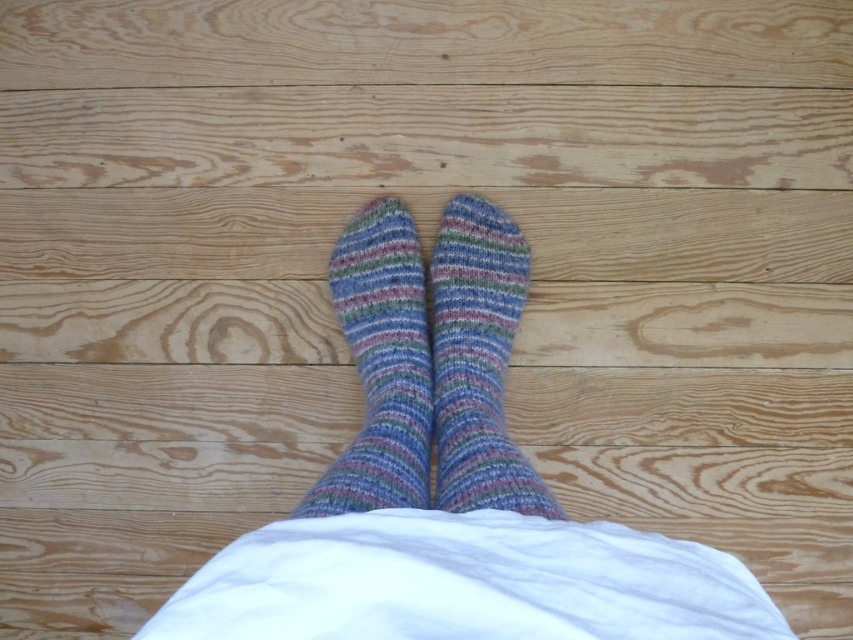
Is point (474, 326) closer to viewer compared to point (395, 376)?

No, (474, 326) is further to viewer.

Is the position of multicolored knitted sock at center less distant than that of multicolored knitted socks at center?

No, multicolored knitted sock at center is behind multicolored knitted socks at center.

This screenshot has width=853, height=640. Find the location of `multicolored knitted sock at center`. multicolored knitted sock at center is located at coordinates point(479,360).

You are a GUI agent. You are given a task and a screenshot of the screen. Output one action in this format:
    pyautogui.click(x=<x>, y=<y>)
    Task: Click on the multicolored knitted sock at center
    
    Given the screenshot: What is the action you would take?
    pyautogui.click(x=479, y=360)